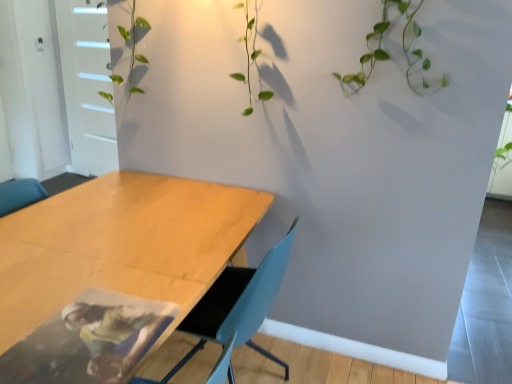
Consider the image. In order to face wooden table at lower left, should I rotate leftwards or rightwards?

Turn left approximately 17.939 degrees to face it.

The height and width of the screenshot is (384, 512). What do you see at coordinates (236, 307) in the screenshot?
I see `light blue plastic chair at center` at bounding box center [236, 307].

Find the location of `wooden table at lower left`. wooden table at lower left is located at coordinates (120, 245).

From the image's perspective, would you say light blue plastic chair at center is positioned over wooden table at lower left?

Indeed, from the image's perspective, light blue plastic chair at center is shown above wooden table at lower left.

Does light blue plastic chair at center contain wooden table at lower left?

No, light blue plastic chair at center does not contain wooden table at lower left.

Is light blue plastic chair at center oriented away from wooden table at lower left?

That's right, light blue plastic chair at center is facing away from wooden table at lower left.

Is light blue plastic chair at center a part of white matte door at upper left?

That's incorrect, light blue plastic chair at center is not inside white matte door at upper left.

This screenshot has width=512, height=384. Find the location of `glass door above the light blue plastic chair at center (from the image's perspective)`. glass door above the light blue plastic chair at center (from the image's perspective) is located at coordinates (87, 85).

You are a GUI agent. You are given a task and a screenshot of the screen. Output one action in this format:
    pyautogui.click(x=<x>, y=<y>)
    Task: Click on the chair below the white matte door at upper left (from a real-world perspective)
    
    Given the screenshot: What is the action you would take?
    pyautogui.click(x=236, y=307)

From a real-world perspective, who is located higher, light blue plastic chair at center or white matte door at upper left?

white matte door at upper left.

Does light blue plastic chair at center turn towards white matte door at upper left?

No, light blue plastic chair at center is not turned towards white matte door at upper left.

The image size is (512, 384). What are the coordinates of `glass door on the left of the wooden table at lower left` in the screenshot? It's located at (87, 85).

Could you tell me if white matte door at upper left is turned towards wooden table at lower left?

No, white matte door at upper left is not turned towards wooden table at lower left.

Which is more to the right, white matte door at upper left or wooden table at lower left?

wooden table at lower left.

Is wooden table at lower left located outside white matte door at upper left?

Absolutely, wooden table at lower left is external to white matte door at upper left.

Would you say wooden table at lower left is to the left or to the right of white matte door at upper left in the picture?

wooden table at lower left is to the right of white matte door at upper left.

Does wooden table at lower left have a smaller size compared to white matte door at upper left?

Actually, wooden table at lower left might be larger than white matte door at upper left.

What's the angular difference between wooden table at lower left and white matte door at upper left's facing directions?

113 degrees.

Is wooden table at lower left positioned far away from light blue plastic chair at center?

wooden table at lower left is near light blue plastic chair at center, not far away.

Which object is positioned more to the left, wooden table at lower left or light blue plastic chair at center?

From the viewer's perspective, wooden table at lower left appears more on the left side.

Consider the image. Is light blue plastic chair at center at the back of wooden table at lower left?

Yes, wooden table at lower left's orientation is away from light blue plastic chair at center.

Is wooden table at lower left thinner than light blue plastic chair at center?

No, wooden table at lower left is not thinner than light blue plastic chair at center.

The width and height of the screenshot is (512, 384). In order to click on table directly beneath the light blue plastic chair at center (from a real-world perspective) in this screenshot , I will do `click(120, 245)`.

This screenshot has width=512, height=384. What are the coordinates of `chair lying in front of the white matte door at upper left` in the screenshot? It's located at (236, 307).

When comparing their distances from light blue plastic chair at center, does white matte door at upper left or wooden table at lower left seem further?

white matte door at upper left is further to light blue plastic chair at center.

Based on their spatial positions, is wooden table at lower left or white matte door at upper left closer to light blue plastic chair at center?

Based on the image, wooden table at lower left appears to be nearer to light blue plastic chair at center.

Estimate the real-world distances between objects in this image. Which object is further from wooden table at lower left, light blue plastic chair at center or white matte door at upper left?

The object further to wooden table at lower left is white matte door at upper left.

Looking at the image, which one is located closer to white matte door at upper left, light blue plastic chair at center or wooden table at lower left?

Among the two, wooden table at lower left is located nearer to white matte door at upper left.

Looking at the image, which one is located further to wooden table at lower left, white matte door at upper left or light blue plastic chair at center?

white matte door at upper left is positioned further to the anchor wooden table at lower left.

Considering their positions, is wooden table at lower left positioned closer to white matte door at upper left than light blue plastic chair at center?

wooden table at lower left is closer to white matte door at upper left.

This screenshot has height=384, width=512. In order to click on chair between wooden table at lower left and white matte door at upper left from front to back in this screenshot , I will do `click(236, 307)`.